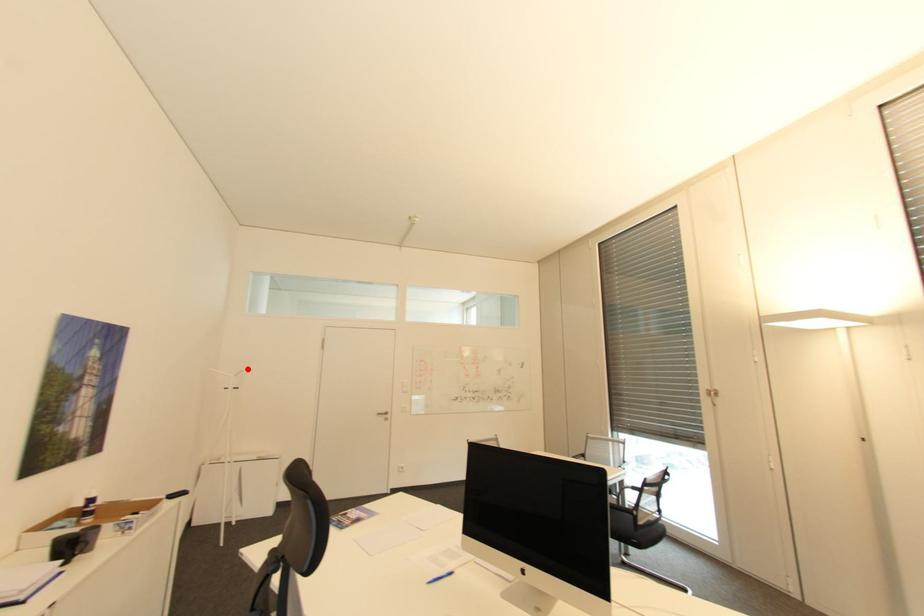
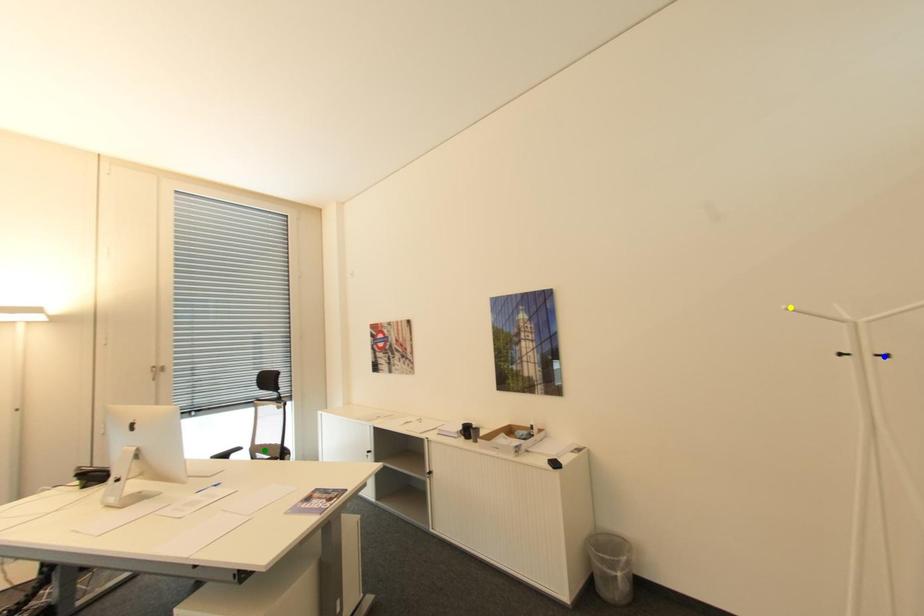
Question: I am providing you with two images of the same scene from different viewpoints. A red point is marked on the first image. You are given multiple points on the second image. Can you choose the point in image 2 that corresponds to the point in image 1?

Choices:
 (A) green point
 (B) yellow point
 (C) blue point

Answer: (B)